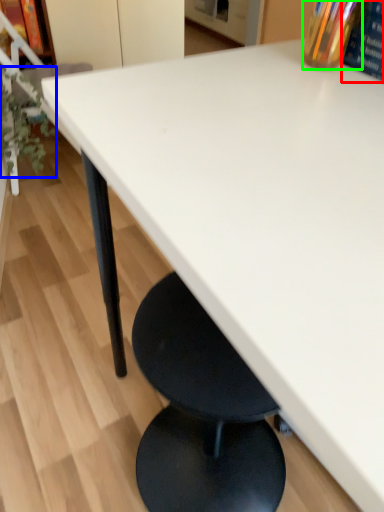
Question: Which object is positioned farthest from paperback book (highlighted by a red box)? Select from plant (highlighted by a blue box) and bottle (highlighted by a green box).

Choices:
 (A) plant
 (B) bottle

Answer: (A)